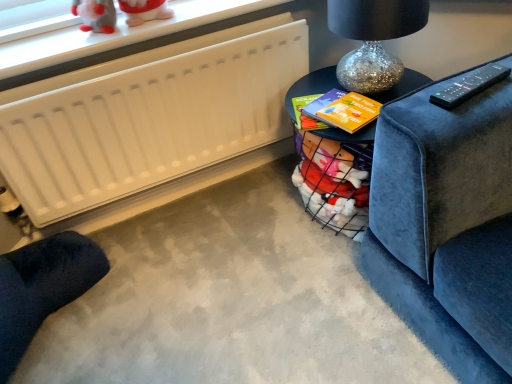
The height and width of the screenshot is (384, 512). Find the location of `free spot in front of black glossy table at center, arranged as the 2th table when viewed from the back`. free spot in front of black glossy table at center, arranged as the 2th table when viewed from the back is located at coordinates (329, 316).